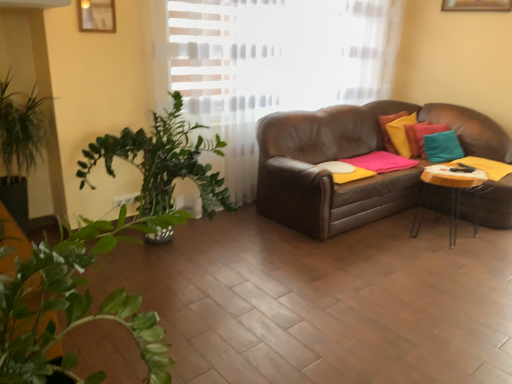
Question: Would you say teal fabric pillow at upper right is a long distance from yellow matte table at right?

Choices:
 (A) yes
 (B) no

Answer: (B)

Question: Is teal fabric pillow at upper right smaller than yellow matte table at right?

Choices:
 (A) yes
 (B) no

Answer: (A)

Question: Is teal fabric pillow at upper right wider than yellow matte table at right?

Choices:
 (A) no
 (B) yes

Answer: (A)

Question: Is teal fabric pillow at upper right positioned beyond the bounds of yellow matte table at right?

Choices:
 (A) no
 (B) yes

Answer: (B)

Question: Is yellow matte table at right completely or partially inside teal fabric pillow at upper right?

Choices:
 (A) yes
 (B) no

Answer: (B)

Question: Does teal fabric pillow at upper right have a larger size compared to yellow matte table at right?

Choices:
 (A) yes
 (B) no

Answer: (B)

Question: From the image's perspective, is wooden picture frame at upper left beneath yellow matte table at right?

Choices:
 (A) no
 (B) yes

Answer: (A)

Question: Considering the relative sizes of wooden picture frame at upper left and yellow matte table at right in the image provided, is wooden picture frame at upper left bigger than yellow matte table at right?

Choices:
 (A) no
 (B) yes

Answer: (A)

Question: From a real-world perspective, is wooden picture frame at upper left positioned under yellow matte table at right based on gravity?

Choices:
 (A) no
 (B) yes

Answer: (A)

Question: Is wooden picture frame at upper left to the right of yellow matte table at right from the viewer's perspective?

Choices:
 (A) no
 (B) yes

Answer: (A)

Question: Is wooden picture frame at upper left aimed at yellow matte table at right?

Choices:
 (A) no
 (B) yes

Answer: (A)

Question: Considering the relative sizes of wooden picture frame at upper left and yellow matte table at right in the image provided, is wooden picture frame at upper left shorter than yellow matte table at right?

Choices:
 (A) no
 (B) yes

Answer: (B)

Question: Can you confirm if yellow matte table at right is thinner than teal fabric pillow at upper right?

Choices:
 (A) no
 (B) yes

Answer: (A)